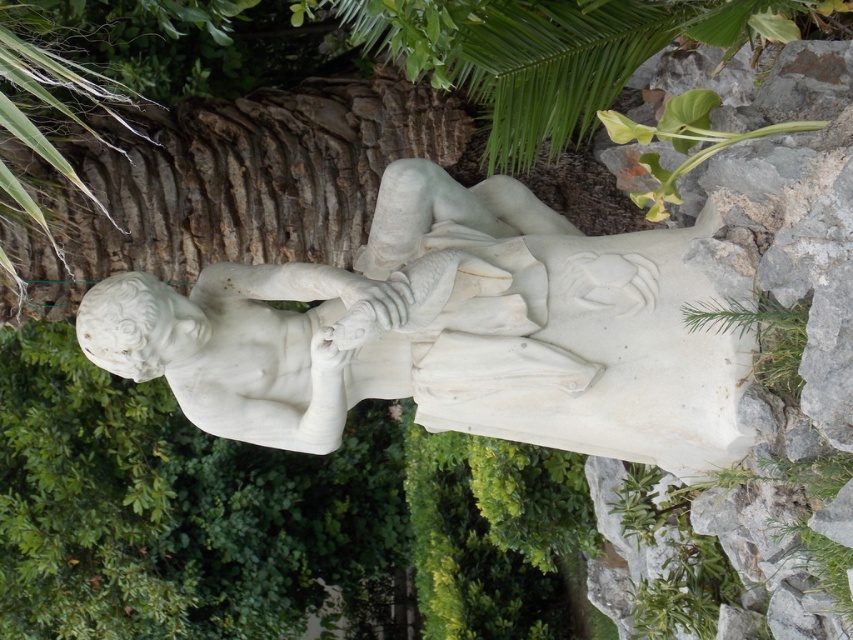
In the scene shown: Can you confirm if white marble statue at center is thinner than green leafy plant at lower right?

No, white marble statue at center is not thinner than green leafy plant at lower right.

The image size is (853, 640). What are the coordinates of `white marble statue at center` in the screenshot? It's located at (351, 317).

Locate an element on the screen. The image size is (853, 640). white marble statue at center is located at coordinates (351, 317).

Where is `white marble statue at center`? white marble statue at center is located at coordinates tap(351, 317).